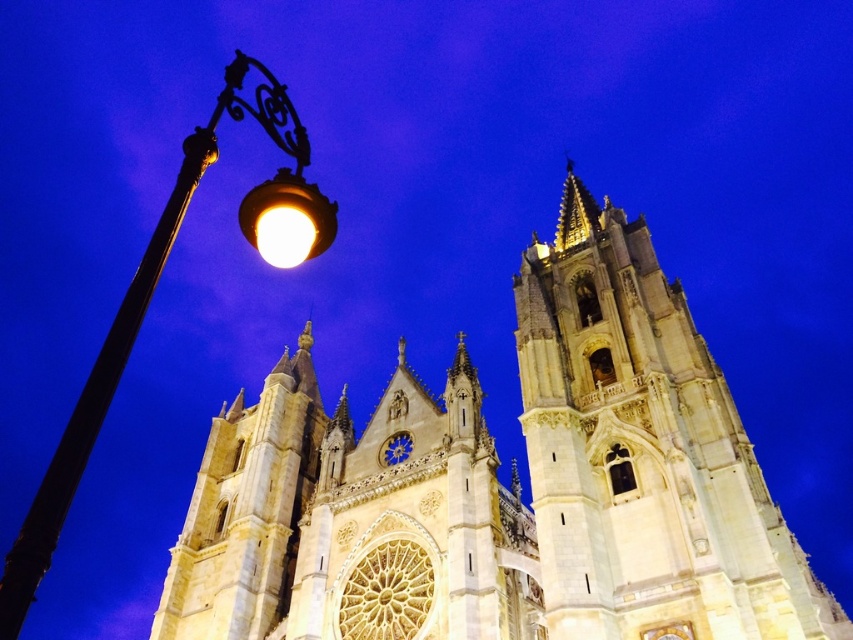
Is point (422, 628) farther from camera compared to point (642, 280)?

No, (422, 628) is closer to viewer.

Is light beige stone church at left above white stone tower at upper right?

No.

Is point (316, 440) closer to camera compared to point (782, 593)?

No, (316, 440) is further to viewer.

I want to click on light beige stone church at left, so click(x=503, y=484).

Is matte glass streetlight at left thinner than matte glass streetlight at upper left?

Incorrect, matte glass streetlight at left's width is not less than matte glass streetlight at upper left's.

Does matte glass streetlight at left appear under matte glass streetlight at upper left?

No.

Is point (291, 244) positioned after point (259, 232)?

That is True.

Find the location of a particular element. The height and width of the screenshot is (640, 853). matte glass streetlight at left is located at coordinates (287, 220).

Is white stone tower at upper right below matte glass streetlight at left?

Indeed, white stone tower at upper right is positioned under matte glass streetlight at left.

Is white stone tower at upper right behind matte glass streetlight at left?

Yes.

Which is in front, point (643, 632) or point (320, 248)?

Positioned in front is point (320, 248).

At what (x,y) coordinates should I click in order to perform the action: click on white stone tower at upper right. Please return your answer as a coordinate pair (x, y). This screenshot has width=853, height=640. Looking at the image, I should click on (643, 452).